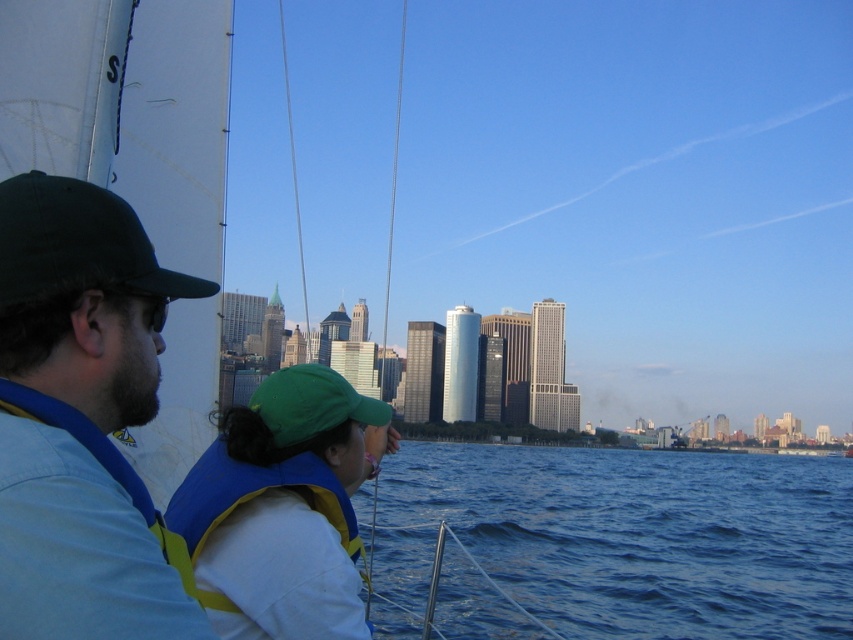
Question: Which object appears closest to the camera in this image?

Choices:
 (A) green fabric cap at center
 (B) green fabric baseball cap at center
 (C) dark green fabric cap at left

Answer: (C)

Question: Can you confirm if blue water at lower center is thinner than green fabric baseball cap at center?

Choices:
 (A) no
 (B) yes

Answer: (A)

Question: Can you confirm if blue water at lower center is positioned to the left of green fabric cap at center?

Choices:
 (A) no
 (B) yes

Answer: (A)

Question: Does dark green fabric cap at left appear over green fabric cap at center?

Choices:
 (A) no
 (B) yes

Answer: (B)

Question: Which object is farther from the camera taking this photo?

Choices:
 (A) green fabric cap at center
 (B) blue water at lower center

Answer: (B)

Question: Among these objects, which one is farthest from the camera?

Choices:
 (A) dark green fabric cap at left
 (B) green fabric cap at center
 (C) green fabric baseball cap at left
 (D) blue water at lower center

Answer: (D)